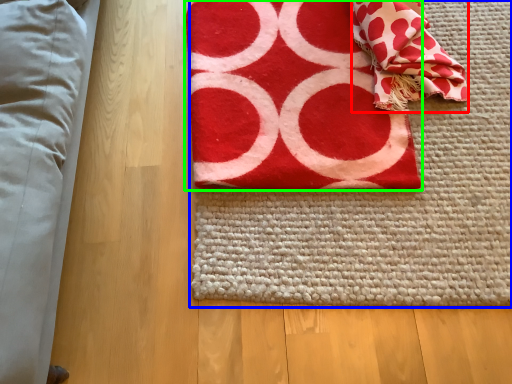
Question: Which is farther away from blanket (highlighted by a red box)? yoga mat (highlighted by a blue box) or towel (highlighted by a green box)?

Choices:
 (A) yoga mat
 (B) towel

Answer: (A)